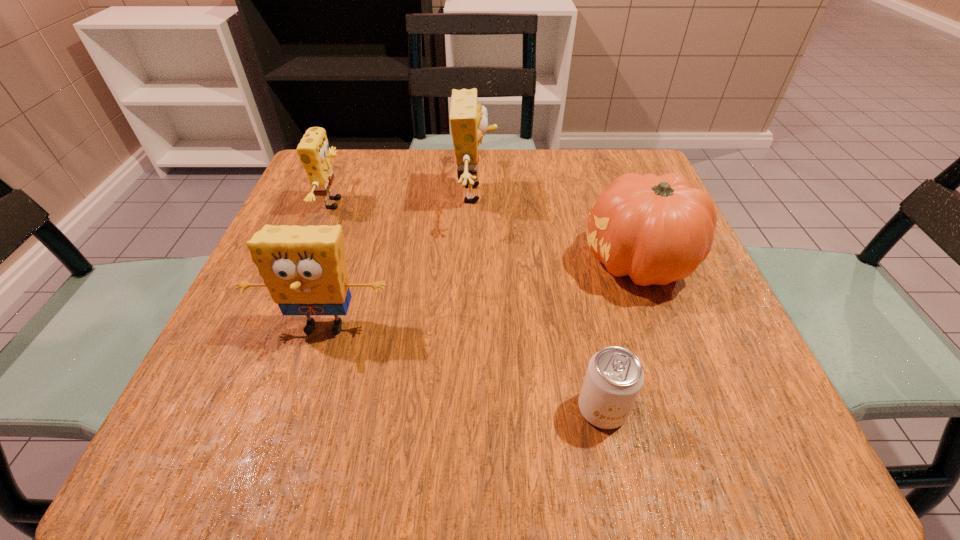
Where is `object that stands as the second closest to the fourth farthest object`? This screenshot has width=960, height=540. object that stands as the second closest to the fourth farthest object is located at coordinates (468, 120).

Select which sponge appears as the closest to the third object from left to right. Please provide its 2D coordinates. Your answer should be formatted as a tuple, i.e. [(x, y)], where the tuple contains the x and y coordinates of a point satisfying the conditions above.

[(304, 268)]

Identify which sponge is the nearest to the shortest sponge. Please provide its 2D coordinates. Your answer should be formatted as a tuple, i.e. [(x, y)], where the tuple contains the x and y coordinates of a point satisfying the conditions above.

[(304, 268)]

Identify the location of vacant space that satisfies the following two spatial constraints: 1. on the face of the nearest sponge; 2. on the right side of the soda can. This screenshot has height=540, width=960. (299, 409).

This screenshot has height=540, width=960. What are the coordinates of `vacant space that satisfies the following two spatial constraints: 1. on the face of the rightmost sponge; 2. on the face of the nearest sponge` in the screenshot? It's located at (473, 326).

Where is `vacant region that satisfies the following two spatial constraints: 1. on the back side of the nearest object; 2. on the face of the shortest sponge`? This screenshot has height=540, width=960. vacant region that satisfies the following two spatial constraints: 1. on the back side of the nearest object; 2. on the face of the shortest sponge is located at coordinates (559, 204).

At what (x,y) coordinates should I click in order to perform the action: click on vacant area in the image that satisfies the following two spatial constraints: 1. on the face of the fourth farthest object; 2. on the right side of the shortest object. Please return your answer as a coordinate pair (x, y). The width and height of the screenshot is (960, 540). Looking at the image, I should click on (299, 409).

At what (x,y) coordinates should I click in order to perform the action: click on vacant space that satisfies the following two spatial constraints: 1. on the face of the shortest sponge; 2. on the back side of the shortest object. Please return your answer as a coordinate pair (x, y). The width and height of the screenshot is (960, 540). Looking at the image, I should click on (253, 409).

Where is `free space that satisfies the following two spatial constraints: 1. on the face of the rightmost sponge; 2. on the face of the second nearest object`? Image resolution: width=960 pixels, height=540 pixels. free space that satisfies the following two spatial constraints: 1. on the face of the rightmost sponge; 2. on the face of the second nearest object is located at coordinates (473, 326).

Identify the location of vacant space that satisfies the following two spatial constraints: 1. on the face of the nearest object; 2. on the right side of the nearest sponge. The height and width of the screenshot is (540, 960). [299, 409].